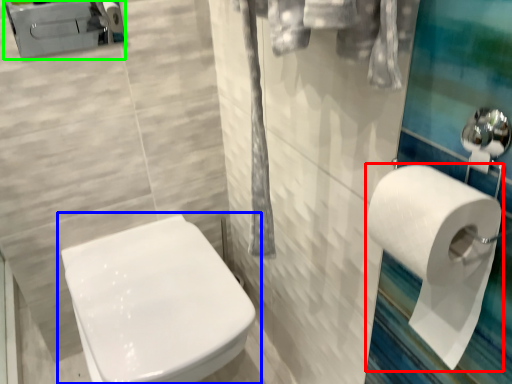
Question: Which is nearer to the toilet paper (highlighted by a red box)? toilet (highlighted by a blue box) or porcelain (highlighted by a green box).

Choices:
 (A) toilet
 (B) porcelain

Answer: (A)